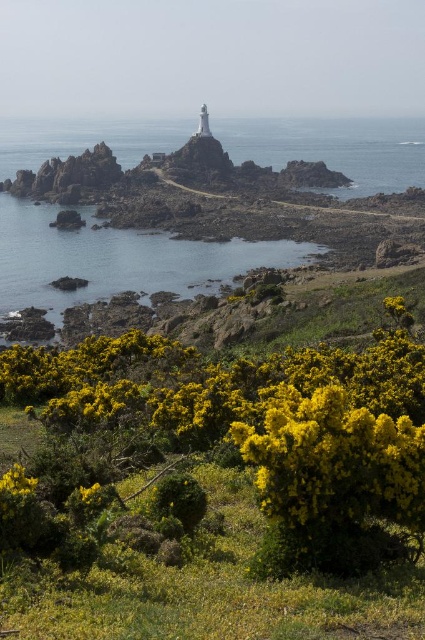
You are a hiker trying to find the lighthouse. You see the yellow fluffy bush at lower center and the transparent blue water at center. Which object is closer to the lighthouse?

The transparent blue water at center is closer to the lighthouse than the yellow fluffy bush at lower center because the yellow fluffy bush at lower center is not as tall as the transparent blue water at center.

You are a hiker who wants to take a photo of the yellow fluffy bush at lower center and the yellow textured bush at lower left. Which bush should you stand closer to in order to capture both in a single frame without zooming?

You should stand closer to the yellow textured bush at lower left because the yellow fluffy bush at lower center is taller than it, so positioning yourself closer to the shorter bush will help include both in the frame without zooming.

Consider the image. You are a hiker who wants to take a photo of the transparent blue water at center without the yellow fluffy bush at lower center blocking the view. What should you do?

Move backward to position yourself further away from the yellow fluffy bush at lower center so that it is no longer in front of the transparent blue water at center.